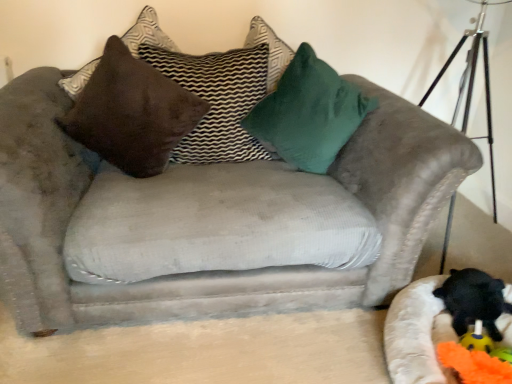
Question: Is the position of black plush toy at lower right more distant than that of orange fabric toy at lower right?

Choices:
 (A) yes
 (B) no

Answer: (A)

Question: Would you say orange fabric toy at lower right is part of black plush toy at lower right's contents?

Choices:
 (A) no
 (B) yes

Answer: (A)

Question: Is black plush toy at lower right outside of orange fabric toy at lower right?

Choices:
 (A) yes
 (B) no

Answer: (A)

Question: From the image's perspective, is black plush toy at lower right on orange fabric toy at lower right?

Choices:
 (A) yes
 (B) no

Answer: (A)

Question: Does black plush toy at lower right have a larger size compared to orange fabric toy at lower right?

Choices:
 (A) no
 (B) yes

Answer: (B)

Question: Is point (251, 122) positioned closer to the camera than point (436, 324)?

Choices:
 (A) closer
 (B) farther

Answer: (B)

Question: From a real-world perspective, is green velvet pillow at upper center, marked as the third pillow in a left-to-right arrangement, physically located above or below orange fabric toy at lower right?

Choices:
 (A) above
 (B) below

Answer: (A)

Question: Do you think green velvet pillow at upper center, the 1th pillow positioned from the right, is within orange fabric toy at lower right, or outside of it?

Choices:
 (A) outside
 (B) inside

Answer: (A)

Question: Visually, is green velvet pillow at upper center, the 1th pillow positioned from the right, positioned to the left or to the right of orange fabric toy at lower right?

Choices:
 (A) right
 (B) left

Answer: (B)

Question: From the image's perspective, relative to beige fabric cat bed at lower right, is orange fabric toy at lower right above or below?

Choices:
 (A) below
 (B) above

Answer: (A)

Question: Does point (501, 377) appear closer or farther from the camera than point (390, 354)?

Choices:
 (A) farther
 (B) closer

Answer: (B)

Question: From their relative heights in the image, would you say orange fabric toy at lower right is taller or shorter than beige fabric cat bed at lower right?

Choices:
 (A) short
 (B) tall

Answer: (A)

Question: Considering the positions of orange fabric toy at lower right and beige fabric cat bed at lower right in the image, is orange fabric toy at lower right wider or thinner than beige fabric cat bed at lower right?

Choices:
 (A) thin
 (B) wide

Answer: (A)

Question: In terms of size, does beige fabric cat bed at lower right appear bigger or smaller than orange fabric toy at lower right?

Choices:
 (A) big
 (B) small

Answer: (A)

Question: Is beige fabric cat bed at lower right wider or thinner than orange fabric toy at lower right?

Choices:
 (A) wide
 (B) thin

Answer: (A)